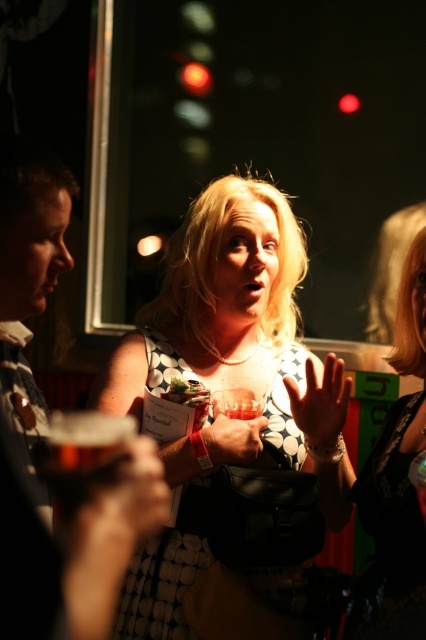
You are at a party and want to find the person wearing the polka dot dress at center and the matte black dress at center. Which one is standing higher?

The polka dot dress at center is taller than the matte black dress at center, so the person wearing the polka dot dress at center is standing higher.

Based on the photo, you are at a social event and want to take a photo of the polka dot dress at center. If your camera has a minimum focus distance of 4 feet, will you be able to capture the dress clearly?

The polka dot dress at center is 4.19 feet away from viewer, so the camera can focus on it since it is slightly beyond the minimum focus distance of 4 feet.